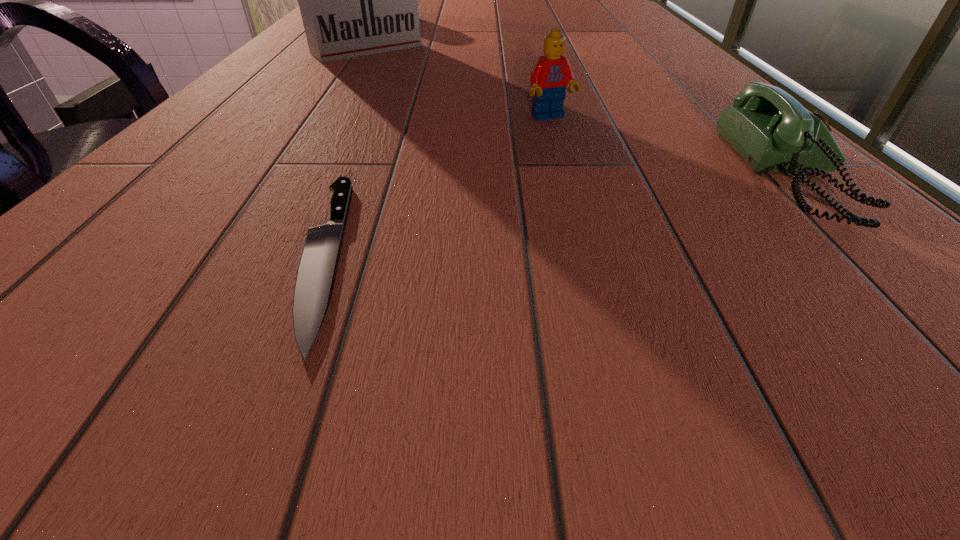
Where is `the shortest object`? the shortest object is located at coordinates (315, 272).

You are a GUI agent. You are given a task and a screenshot of the screen. Output one action in this format:
    pyautogui.click(x=<x>, y=<y>)
    Task: Click on the third tallest object
    
    Given the screenshot: What is the action you would take?
    pyautogui.click(x=767, y=127)

Image resolution: width=960 pixels, height=540 pixels. What are the coordinates of `the rightmost object` in the screenshot? It's located at (767, 127).

This screenshot has height=540, width=960. I want to click on the third nearest object, so click(551, 74).

Identify the location of the third shortest object. This screenshot has height=540, width=960. (551, 74).

You are a GUI agent. You are given a task and a screenshot of the screen. Output one action in this format:
    pyautogui.click(x=<x>, y=<y>)
    Task: Click on the tallest object
    The width and height of the screenshot is (960, 540).
    Given the screenshot: What is the action you would take?
    pyautogui.click(x=355, y=0)

Where is `the farthest object`? This screenshot has width=960, height=540. the farthest object is located at coordinates [x=355, y=0].

At what (x,y) coordinates should I click in order to perform the action: click on free region located on the back of the shortest object. Please return your answer as a coordinate pair (x, y). The width and height of the screenshot is (960, 540). Looking at the image, I should click on (366, 157).

Where is `free space located 0.270m on the face of the third shortest object`? The image size is (960, 540). free space located 0.270m on the face of the third shortest object is located at coordinates (655, 217).

I want to click on vacant space located 0.170m on the face of the third shortest object, so click(612, 176).